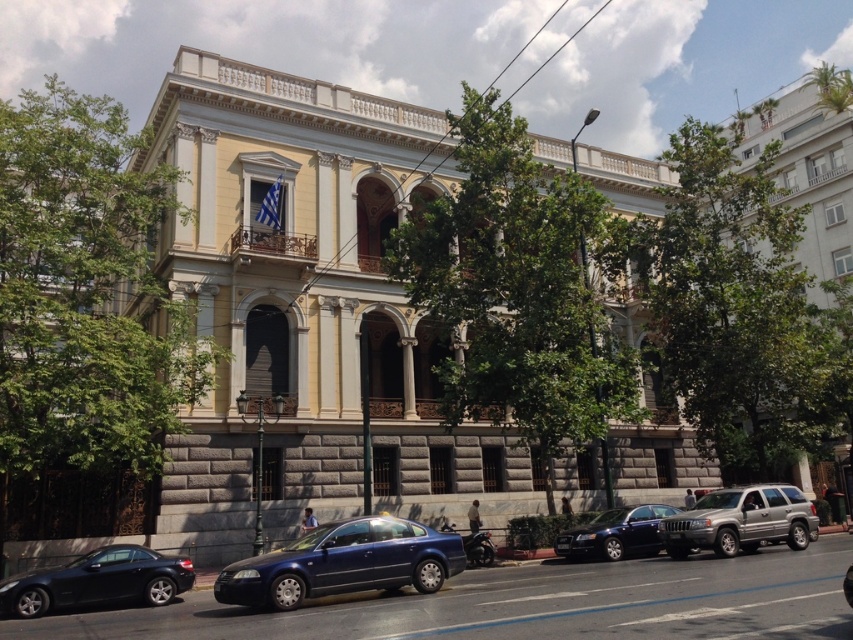
Question: Which of these objects is positioned closest to the shiny black car at lower left?

Choices:
 (A) glossy metallic sedan at center
 (B) shiny black sedan at center

Answer: (A)

Question: Does glossy metallic sedan at center appear under silver metallic suv at center?

Choices:
 (A) no
 (B) yes

Answer: (B)

Question: Is shiny black car at lower left thinner than silver metallic suv at center?

Choices:
 (A) no
 (B) yes

Answer: (B)

Question: Among these objects, which one is nearest to the camera?

Choices:
 (A) glossy metallic sedan at center
 (B) silver metallic suv at center

Answer: (A)

Question: Is silver metallic suv at center wider than shiny black sedan at center?

Choices:
 (A) yes
 (B) no

Answer: (B)

Question: Which of these objects is positioned closest to the glossy metallic sedan at center?

Choices:
 (A) shiny black sedan at center
 (B) shiny black car at lower left
 (C) silver metallic suv at center

Answer: (B)